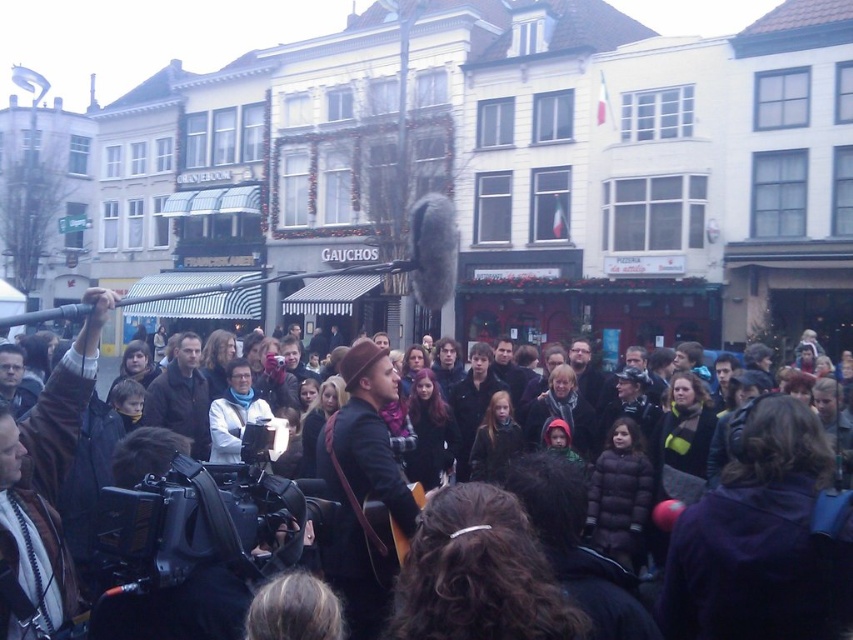
You are a photographer at the event and want to capture both the black plastic video camera at center and the dark brown leather jacket at center in a single photo. Which object should you focus on first to ensure both are in frame?

You should focus on the dark brown leather jacket at center first since the black plastic video camera at center is shorter than it, allowing both to fit within the frame.

You are a photographer at the event and want to capture both the black plastic video camera at center and the dark brown leather jacket at center in a single frame. Which object should you zoom in on to ensure both fit in the shot?

The black plastic video camera at center has a lesser width compared to the dark brown leather jacket at center, so you should zoom in on the larger object, the dark brown leather jacket at center, to ensure both fit in the shot.

You are a photographer at the event and need to position your camera to capture the performer and the GAUCHOS sign on the building. The black plastic video camera at center is currently at point 0.819, 0.231. Is the camera positioned to include both the performer and the sign in the frame?

The black plastic video camera at center is located at point (x=196, y=524). Based on this coordinate, the camera should be able to capture both the performer and the GAUCHOS sign in the frame as they are central elements in the scene.